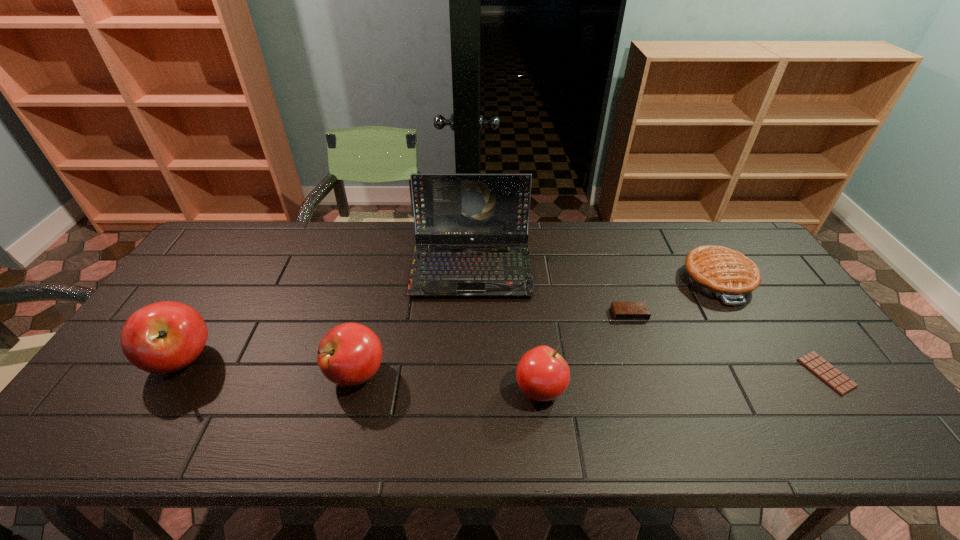
I want to click on the leftmost object, so click(163, 337).

You are a GUI agent. You are given a task and a screenshot of the screen. Output one action in this format:
    pyautogui.click(x=<x>, y=<y>)
    Task: Click on the second tallest apple
    This screenshot has height=540, width=960.
    Given the screenshot: What is the action you would take?
    pyautogui.click(x=350, y=354)

The height and width of the screenshot is (540, 960). In order to click on the second apple from left to right in this screenshot , I will do `click(350, 354)`.

Identify the location of the fourth shortest object. The width and height of the screenshot is (960, 540). (542, 374).

The image size is (960, 540). Find the location of `the rightmost apple`. the rightmost apple is located at coordinates (542, 374).

Where is `the fifth object from left to right`? This screenshot has width=960, height=540. the fifth object from left to right is located at coordinates (621, 310).

The image size is (960, 540). In order to click on the sixth tallest object in this screenshot , I will do `click(621, 310)`.

Locate an element on the screen. This screenshot has width=960, height=540. laptop computer is located at coordinates (449, 208).

The height and width of the screenshot is (540, 960). In order to click on the third shortest object in this screenshot , I will do `click(719, 272)`.

Locate an element on the screen. the shortest object is located at coordinates (839, 382).